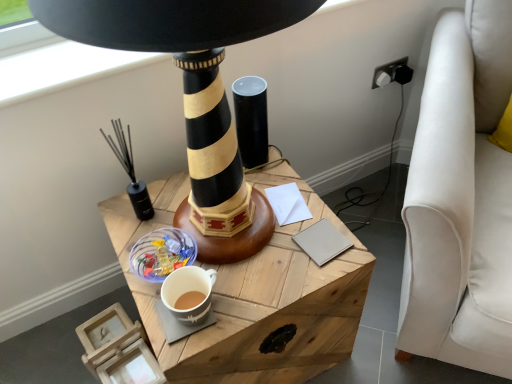
Find the location of a particular element. Image resolution: width=512 pixels, height=384 pixels. free space in front of matte black cylinder at center, which is counted as the 2th candle holder, starting from the left is located at coordinates 275,191.